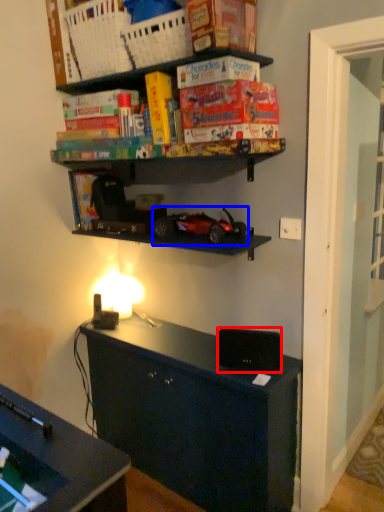
Question: Which of the following is the farthest to the observer, speaker (highlighted by a red box) or model car (highlighted by a blue box)?

Choices:
 (A) speaker
 (B) model car

Answer: (A)